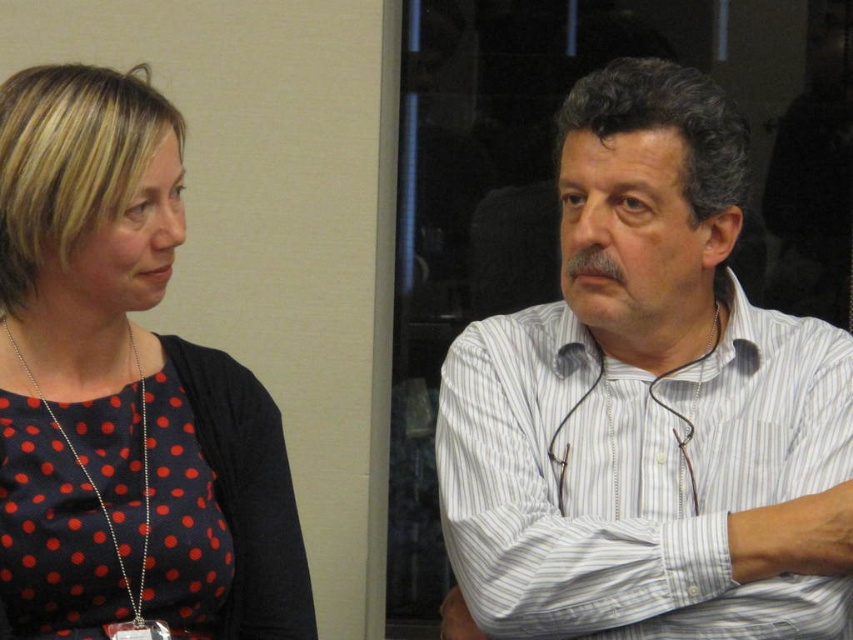
You are an interior designer observing the scene. You need to hang a picture frame between the white striped shirt at right and the polka dot fabric dress at left. Based on their positions, where should you place the frame?

The white striped shirt at right is below the polka dot fabric dress at left, so the picture frame should be placed between them horizontally, aligned with the lower position of the white striped shirt at right and the higher position of the polka dot fabric dress at left.

You are standing in a room with two people talking. The person on the left is wearing a dark blue top with red polka dots and has a black cardigan over their shoulders. The person on the right has curly dark hair and is wearing a striped white shirt with glasses around their neck. There is a point at coordinate (637,372) in the image. Can you determine if this point is closer to the camera than 1.5 meters?

The point at coordinate (637,372) is 1.29 meters from the camera, which is less than 1.5 meters. Therefore, the point is closer to the camera than 1.5 meters.

Based on the photo, you are a photographer setting up a shoot in this scene. You need to position a spotlight so that it illuminates both the white striped shirt at right and the polka dot fabric dress at left without casting shadows on the off white wall. Considering their positions, which object should be closer to the spotlight to avoid shadows?

The polka dot fabric dress at left is behind the white striped shirt at right, so to avoid casting shadows on the off white wall, the white striped shirt at right should be closer to the spotlight. This way, the dress behind it won